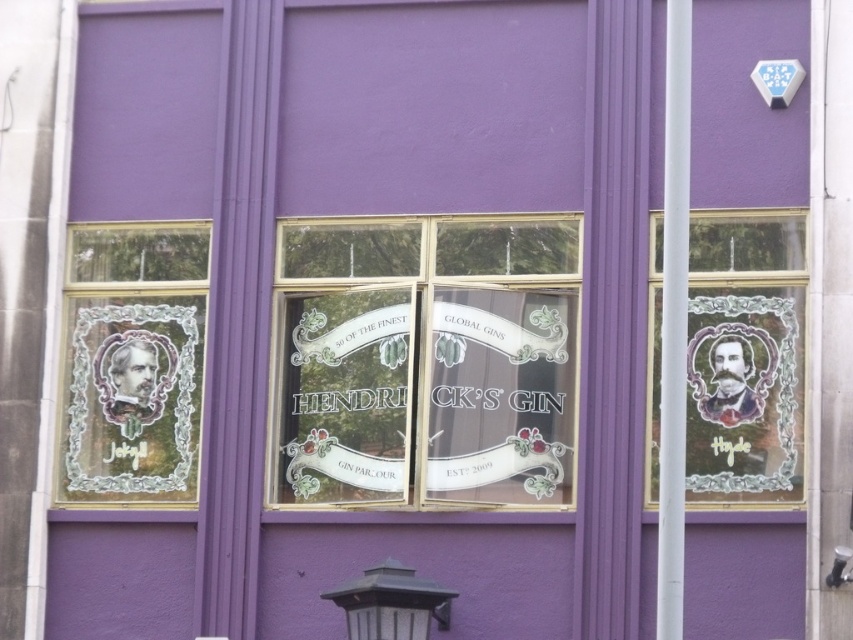
Question: Which object is closer to the camera taking this photo?

Choices:
 (A) black matte lamp post at lower center
 (B) clear glass hendrick's gin sign at center
 (C) translucent glass portrait at right
 (D) matte glass portrait at left

Answer: (A)

Question: Which of the following is the closest to the observer?

Choices:
 (A) clear glass hendrick's gin sign at center
 (B) translucent glass portrait at right

Answer: (B)

Question: Is clear glass hendrick's gin sign at center in front of matte glass portrait at left?

Choices:
 (A) yes
 (B) no

Answer: (A)

Question: Is clear glass hendrick's gin sign at center thinner than matte glass portrait at left?

Choices:
 (A) no
 (B) yes

Answer: (A)

Question: From the image, what is the correct spatial relationship of matte glass portrait at left in relation to black matte lamp post at lower center?

Choices:
 (A) below
 (B) above

Answer: (B)

Question: Which point is farther to the camera?

Choices:
 (A) translucent glass portrait at right
 (B) clear glass hendrick's gin sign at center
 (C) black matte lamp post at lower center

Answer: (B)